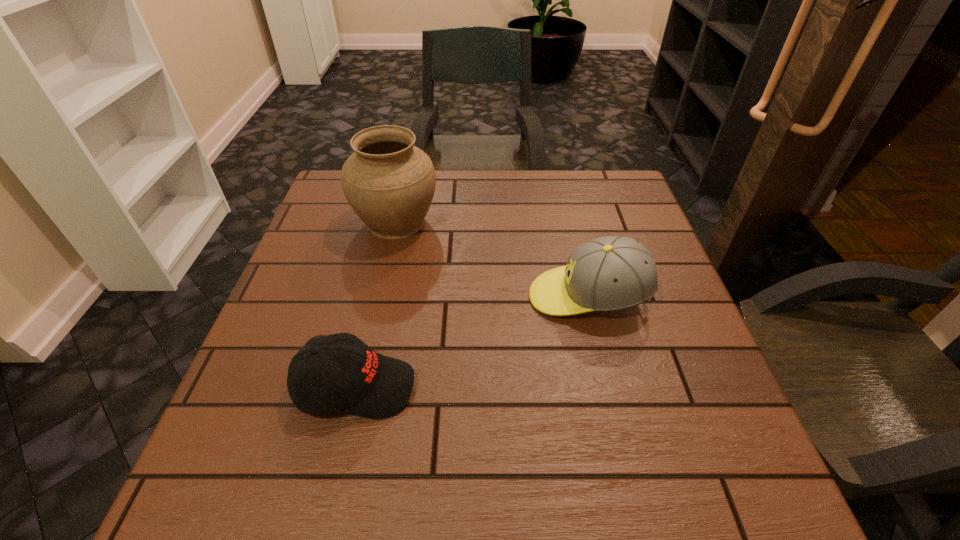
Where is `free space between the taller baseball cap and the urn`? The image size is (960, 540). free space between the taller baseball cap and the urn is located at coordinates (492, 259).

Find the location of a particular element. the second closest object to the shorter baseball cap is located at coordinates (390, 183).

Select which object appears as the closest to the taller baseball cap. Please provide its 2D coordinates. Your answer should be formatted as a tuple, i.e. [(x, y)], where the tuple contains the x and y coordinates of a point satisfying the conditions above.

[(390, 183)]

The image size is (960, 540). In order to click on vacant region that satisfies the following two spatial constraints: 1. on the front side of the farthest object; 2. on the front-facing side of the nearest object in this screenshot , I will do `click(359, 387)`.